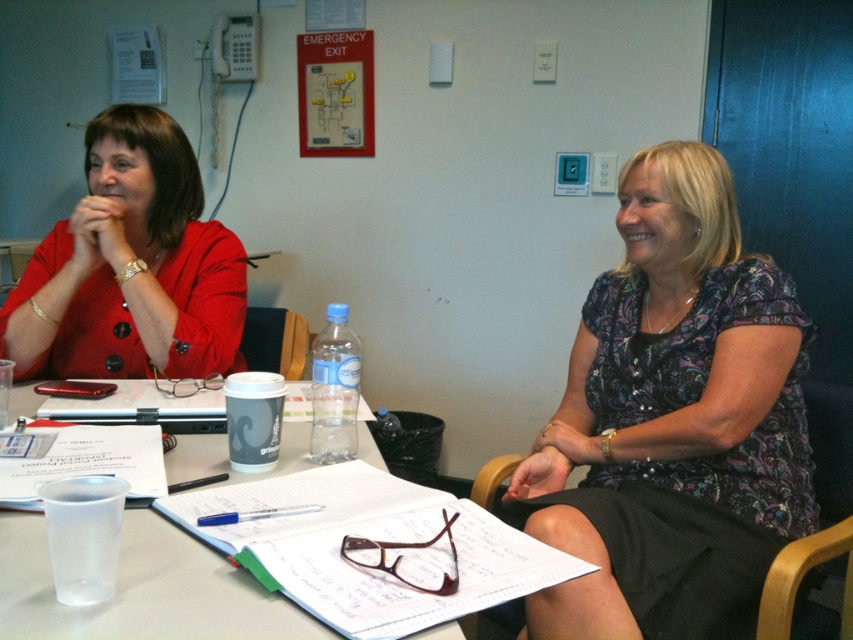
Question: Which object appears farthest from the camera in this image?

Choices:
 (A) clear plastic cup at center
 (B) patterned fabric blouse at center

Answer: (B)

Question: Considering the relative positions of patterned fabric blouse at center and clear plastic cup at center in the image provided, where is patterned fabric blouse at center located with respect to clear plastic cup at center?

Choices:
 (A) below
 (B) above

Answer: (B)

Question: Estimate the real-world distances between objects in this image. Which object is closer to the matte red blazer at left?

Choices:
 (A) patterned fabric blouse at center
 (B) clear plastic cup at center

Answer: (B)

Question: Can you confirm if patterned fabric blouse at center is positioned to the right of clear plastic cup at center?

Choices:
 (A) yes
 (B) no

Answer: (A)

Question: Which point is closer to the camera taking this photo?

Choices:
 (A) pyautogui.click(x=234, y=282)
 (B) pyautogui.click(x=602, y=618)

Answer: (B)

Question: Does matte red blazer at left have a greater width compared to clear plastic cup at center?

Choices:
 (A) no
 (B) yes

Answer: (A)